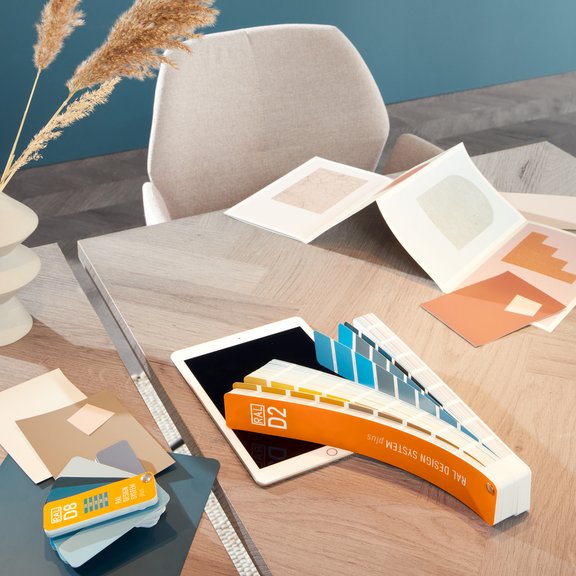
The image size is (576, 576). Find the location of `ipad or other tablet`. ipad or other tablet is located at coordinates (245, 348).